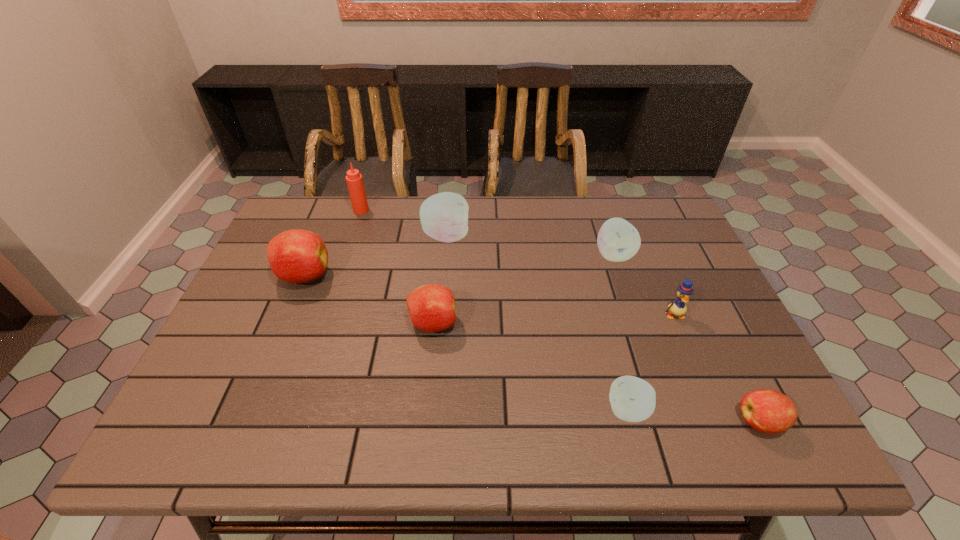
Identify the location of Tabasco sauce. [354, 179].

At what (x,y) coordinates should I click in order to perform the action: click on the leftmost white apple. Please return your answer as a coordinate pair (x, y). This screenshot has width=960, height=540. Looking at the image, I should click on (444, 216).

What are the coordinates of `the leftmost red apple` in the screenshot? It's located at (296, 256).

Where is `the leftmost apple`? The image size is (960, 540). the leftmost apple is located at coordinates (296, 256).

Find the location of a particular element. the second smallest white apple is located at coordinates (618, 240).

Where is `duckling`? This screenshot has height=540, width=960. duckling is located at coordinates (678, 307).

The width and height of the screenshot is (960, 540). I want to click on yellow duckling, so click(x=678, y=307).

This screenshot has width=960, height=540. I want to click on the second biggest red apple, so click(432, 308).

You are a GUI agent. You are given a task and a screenshot of the screen. Output one action in this format:
    pyautogui.click(x=<x>, y=<y>)
    Task: Click on the second nearest red apple
    
    Given the screenshot: What is the action you would take?
    pyautogui.click(x=432, y=308)

Where is `the nearest white apple`? This screenshot has width=960, height=540. the nearest white apple is located at coordinates (632, 399).